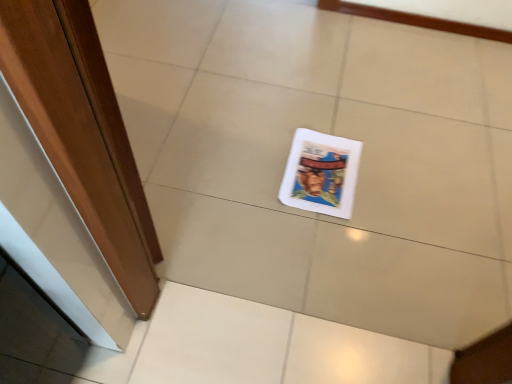
Where is `free space to the back side of wooden door at left`? The width and height of the screenshot is (512, 384). free space to the back side of wooden door at left is located at coordinates (179, 84).